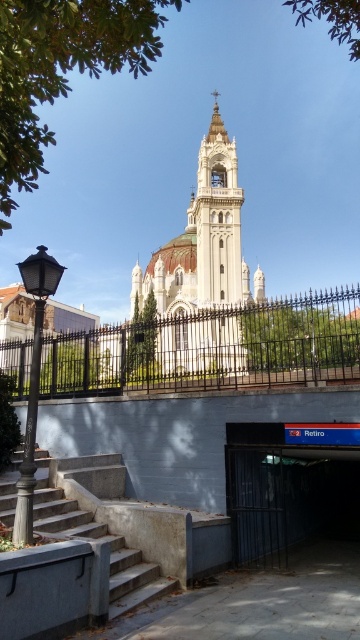
Question: Which object is closer to the camera taking this photo?

Choices:
 (A) white stone tower at center
 (B) dark blue concrete entrance at lower center

Answer: (B)

Question: In this image, where is black wrought iron fence at center located relative to white stone tower at center?

Choices:
 (A) left
 (B) right

Answer: (A)

Question: Estimate the real-world distances between objects in this image. Which object is closer to the black wrought iron fence at center?

Choices:
 (A) white stone tower at center
 (B) dark blue concrete entrance at lower center

Answer: (A)

Question: Where is black wrought iron fence at center located in relation to concrete stairs at lower left in the image?

Choices:
 (A) left
 (B) right

Answer: (B)

Question: Considering the real-world distances, which object is farthest from the black wrought iron fence at center?

Choices:
 (A) concrete stairs at lower left
 (B) white stone tower at center
 (C) dark blue concrete entrance at lower center

Answer: (A)

Question: From the image, what is the correct spatial relationship of white stone tower at center in relation to concrete stairs at lower left?

Choices:
 (A) above
 (B) below

Answer: (A)